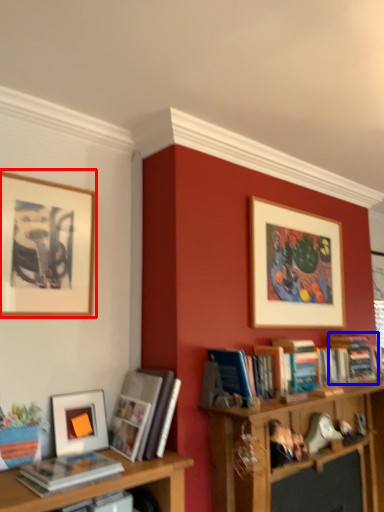
Question: Which of the following is the farthest to the observer, picture frame (highlighted by a red box) or book (highlighted by a blue box)?

Choices:
 (A) picture frame
 (B) book

Answer: (B)